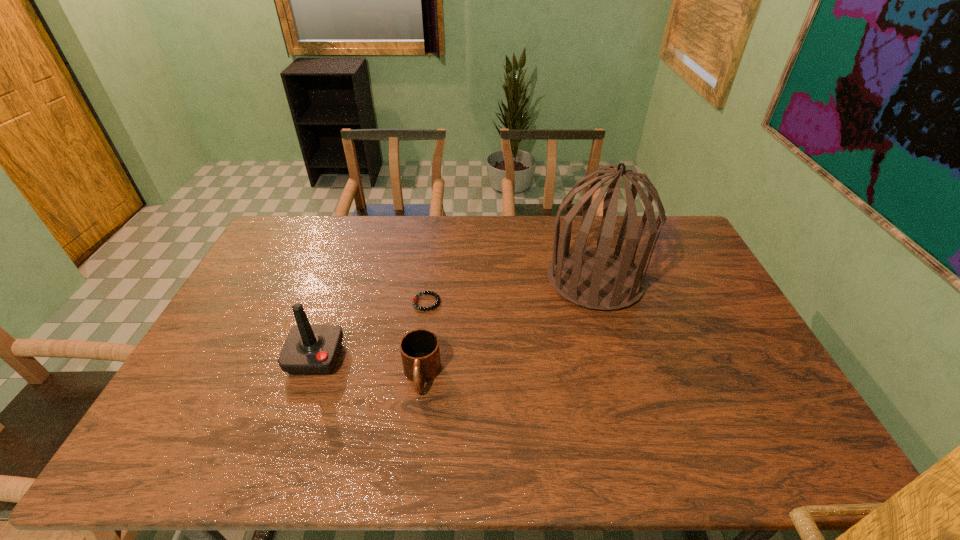
I want to click on vacant space in between the leftmost object and the tallest object, so click(455, 319).

The image size is (960, 540). Identify the location of empty location between the second shortest object and the joystick. (369, 367).

At what (x,y) coordinates should I click in order to perform the action: click on vacant point located between the third shortest object and the third tallest object. Please return your answer as a coordinate pair (x, y). Looking at the image, I should click on (369, 367).

This screenshot has height=540, width=960. I want to click on object that is the second closest one to the shortest object, so click(x=309, y=349).

Where is `the third closest object to the tallest object`? This screenshot has width=960, height=540. the third closest object to the tallest object is located at coordinates (309, 349).

The height and width of the screenshot is (540, 960). What are the coordinates of `blank area in the image that satisfies the following two spatial constraints: 1. on the back side of the tallest object; 2. on the right side of the shortest object` in the screenshot? It's located at (429, 280).